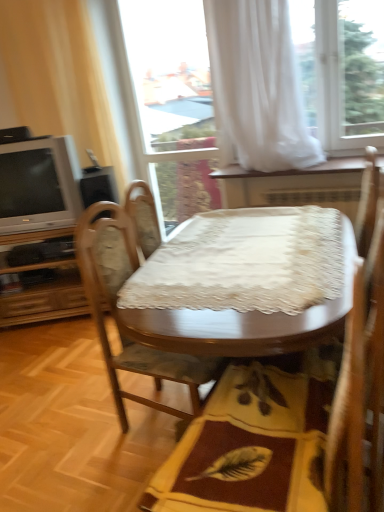
Identify the location of wooden dresser at left. Image resolution: width=384 pixels, height=512 pixels. (45, 295).

This screenshot has height=512, width=384. What do you see at coordinates (179, 319) in the screenshot?
I see `wooden table at center` at bounding box center [179, 319].

What is the approximate height of transparent glass door at upper center?

transparent glass door at upper center is 1.83 meters in height.

Find the location of `yellow fabric mat at center`. yellow fabric mat at center is located at coordinates (247, 447).

Can you confirm if wooden table at center is bigger than yellow fabric mat at center?

Indeed, wooden table at center has a larger size compared to yellow fabric mat at center.

In the scene shown: Would you say wooden table at center is outside yellow fabric mat at center?

Yes, wooden table at center is outside of yellow fabric mat at center.

Between wooden table at center and yellow fabric mat at center, which one appears on the right side from the viewer's perspective?

wooden table at center.

Considering the relative positions of wooden dresser at left and wooden chair at center in the image provided, is wooden dresser at left in front of wooden chair at center?

No, the depth of wooden dresser at left is greater than that of wooden chair at center.

Is wooden dresser at left next to wooden chair at center and touching it?

No, wooden dresser at left is not with wooden chair at center.

Where is `chair in front of the wooden dresser at left`? The height and width of the screenshot is (512, 384). chair in front of the wooden dresser at left is located at coordinates (116, 310).

You are a GUI agent. You are given a task and a screenshot of the screen. Output one action in this format:
    pyautogui.click(x=<x>, y=<y>)
    Task: Click on the dresser lying on the left of transparent glass door at upper center
    This screenshot has width=384, height=512.
    Given the screenshot: What is the action you would take?
    pyautogui.click(x=45, y=295)

From a real-world perspective, is wooden dresser at left above or below transparent glass door at upper center?

wooden dresser at left is below transparent glass door at upper center.

Is wooden dresser at left not inside transparent glass door at upper center?

Yes, wooden dresser at left is located beyond the bounds of transparent glass door at upper center.

Is wooden chair at center with wooden dresser at left?

No, wooden chair at center is not next to wooden dresser at left.

Can you confirm if wooden chair at center is thinner than wooden dresser at left?

Yes.

Can you confirm if wooden chair at center is positioned to the right of wooden dresser at left?

Yes, wooden chair at center is to the right of wooden dresser at left.

From the picture: Which is in front, wooden chair at center or wooden dresser at left?

wooden chair at center is closer to the camera.

Is beige fabric curtain at left, which is counted as the 1th curtain, starting from the left, facing towards wooden chair at center?

No, beige fabric curtain at left, which is counted as the 1th curtain, starting from the left, does not turn towards wooden chair at center.

Is beige fabric curtain at left, which is counted as the 1th curtain, starting from the left, touching wooden chair at center?

No, beige fabric curtain at left, which is counted as the 1th curtain, starting from the left, is not touching wooden chair at center.

Which of these two, beige fabric curtain at left, which ranks as the 2th curtain in right-to-left order, or wooden chair at center, is bigger?

beige fabric curtain at left, which ranks as the 2th curtain in right-to-left order.

Would you consider wooden table at center to be distant from wooden dresser at left?

Yes, wooden table at center and wooden dresser at left are quite far apart.

Which object is positioned more to the left, wooden table at center or wooden dresser at left?

wooden dresser at left.

Who is more distant, wooden table at center or wooden dresser at left?

Positioned behind is wooden dresser at left.

Based on their sizes in the image, would you say wooden table at center is bigger or smaller than wooden dresser at left?

Clearly, wooden table at center is larger in size than wooden dresser at left.

Who is bigger, matte silver television at left or wooden chair at center?

Bigger between the two is wooden chair at center.

Is matte silver television at left situated inside wooden chair at center or outside?

matte silver television at left is not enclosed by wooden chair at center.

Considering the positions of points (30, 155) and (118, 257), is point (30, 155) farther from camera compared to point (118, 257)?

That is True.

What's the angular difference between matte silver television at left and wooden chair at center's facing directions?

matte silver television at left and wooden chair at center are facing 69 degrees away from each other.

Locate an element on the screen. The height and width of the screenshot is (512, 384). mat below the wooden table at center (from the image's perspective) is located at coordinates (247, 447).

Where is `chair on the right of wooden dresser at left`? chair on the right of wooden dresser at left is located at coordinates (116, 310).

Based on their spatial positions, is wooden dresser at left or yellow fabric mat at center further from beige fabric curtain at left, which ranks as the 2th curtain in right-to-left order?

Among the two, yellow fabric mat at center is located further to beige fabric curtain at left, which ranks as the 2th curtain in right-to-left order.

From the image, which object appears to be nearer to matte silver television at left, white sheer curtain at upper center, which ranks as the first curtain in right-to-left order, or beige fabric curtain at left, which is counted as the 1th curtain, starting from the left?

beige fabric curtain at left, which is counted as the 1th curtain, starting from the left, lies closer to matte silver television at left than the other object.

In the scene shown: Looking at the image, which one is located closer to wooden dresser at left, wooden chair at center or matte silver television at left?

The object closer to wooden dresser at left is matte silver television at left.

Looking at the image, which one is located further to wooden table at center, matte silver television at left or wooden chair at center?

The object further to wooden table at center is matte silver television at left.

Looking at the image, which one is located further to wooden chair at center, matte silver television at left or wooden table at center?

matte silver television at left lies further to wooden chair at center than the other object.

Estimate the real-world distances between objects in this image. Which object is closer to wooden table at center, beige fabric curtain at left, which ranks as the 2th curtain in right-to-left order, or wooden chair at center?

Based on the image, wooden chair at center appears to be nearer to wooden table at center.

Considering their positions, is beige fabric curtain at left, which is counted as the 1th curtain, starting from the left, positioned closer to matte silver television at left than wooden table at center?

beige fabric curtain at left, which is counted as the 1th curtain, starting from the left, is closer to matte silver television at left.

Considering their positions, is transparent glass door at upper center positioned closer to wooden dresser at left than matte silver television at left?

matte silver television at left is positioned closer to the anchor wooden dresser at left.

At what (x,y) coordinates should I click in order to perform the action: click on glass door between beige fabric curtain at left, which is counted as the 1th curtain, starting from the left, and white sheer curtain at upper center, which ranks as the first curtain in right-to-left order. Please return your answer as a coordinate pair (x, y). This screenshot has height=512, width=384. Looking at the image, I should click on (171, 101).

I want to click on chair between yellow fabric mat at center and beige fabric curtain at left, which is counted as the 1th curtain, starting from the left, in the front-back direction, so click(116, 310).

The height and width of the screenshot is (512, 384). I want to click on television situated between wooden dresser at left and white sheer curtain at upper center, which ranks as the first curtain in right-to-left order, from left to right, so click(x=39, y=185).

What are the coordinates of `chair between matte silver television at left and white sheer curtain at upper center, the second curtain positioned from the left` in the screenshot? It's located at [x=116, y=310].